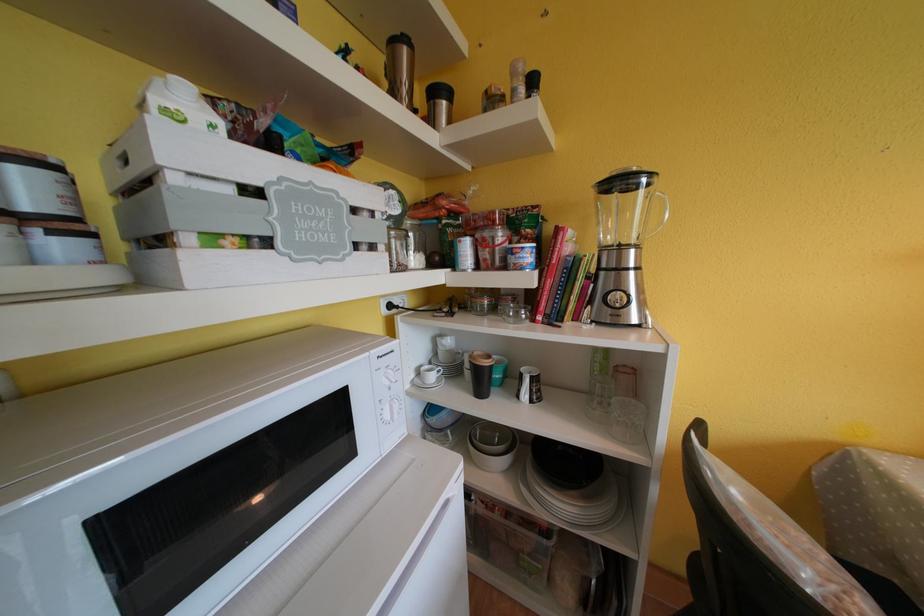
This screenshot has width=924, height=616. I want to click on blender lid, so click(x=624, y=169).